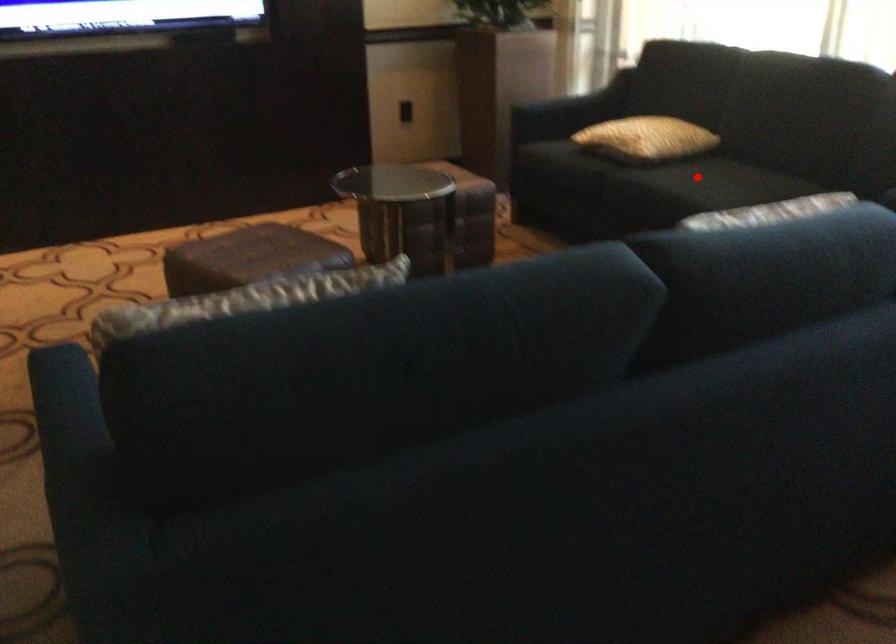
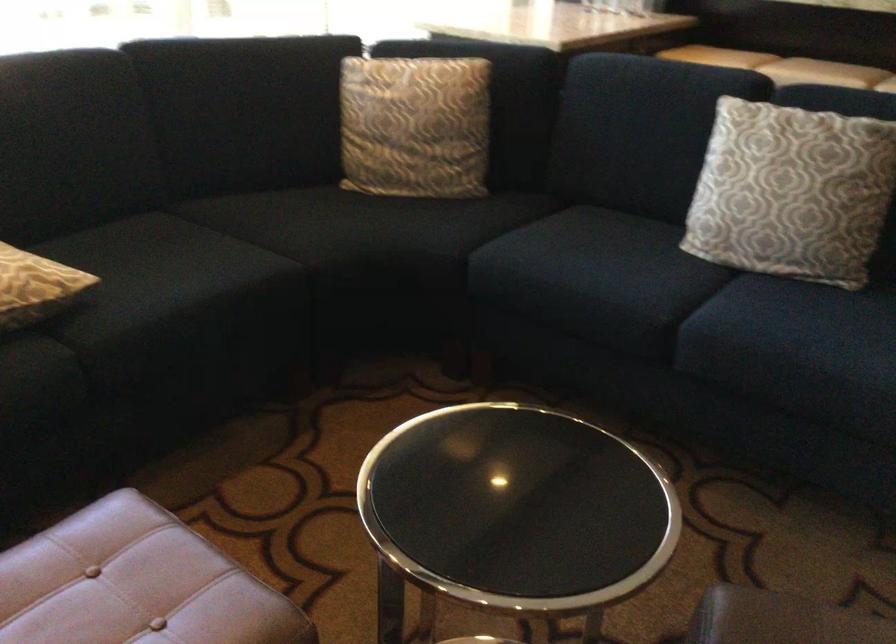
Question: A red point is marked in image1. In image2, is the corresponding 3D point closer to the camera or farther? Reply with the corresponding letter.

Choices:
 (A) The corresponding 3D point is closer.
 (B) The corresponding 3D point is farther.

Answer: (A)